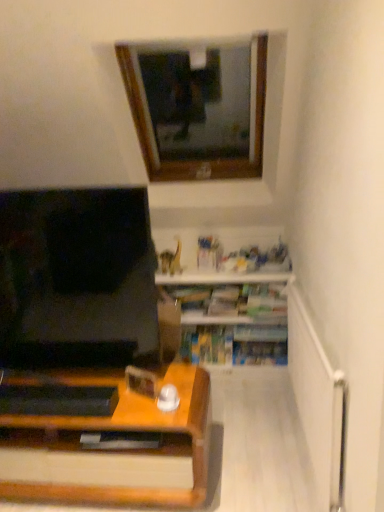
Find the location of a particular element. This screenshot has width=384, height=512. white glossy shelf at lower center is located at coordinates (230, 301).

Measure the distance between point (285, 349) and camera.

Point (285, 349) and camera are 2.75 meters apart.

What do you see at coordinates (230, 301) in the screenshot? This screenshot has width=384, height=512. I see `white glossy shelf at lower center` at bounding box center [230, 301].

In order to face white glossy shelf at lower center, should I rotate leftwards or rightwards?

To face it directly, rotate right by 4.324 degrees.

I want to click on wooden frame at upper center, so click(x=198, y=108).

The height and width of the screenshot is (512, 384). What do you see at coordinates (198, 108) in the screenshot?
I see `wooden frame at upper center` at bounding box center [198, 108].

Where is `white glossy shelf at lower center`? The image size is (384, 512). white glossy shelf at lower center is located at coordinates (230, 301).

Which object is positioned more to the left, white glossy shelf at lower center or wooden frame at upper center?

From the viewer's perspective, wooden frame at upper center appears more on the left side.

Is white glossy shelf at lower center in front of wooden frame at upper center?

No.

Which point is more forward, (245, 326) or (240, 123)?

Positioned in front is point (245, 326).

Consider the image. From the image's perspective, which object appears higher, white glossy shelf at lower center or wooden frame at upper center?

wooden frame at upper center.

From a real-world perspective, is white glossy shelf at lower center physically above wooden frame at upper center?

No.

Is white glossy shelf at lower center thinner than wooden frame at upper center?

Indeed, white glossy shelf at lower center has a lesser width compared to wooden frame at upper center.

Can you confirm if white glossy shelf at lower center is shorter than wooden frame at upper center?

Correct, white glossy shelf at lower center is not as tall as wooden frame at upper center.

In terms of size, does white glossy shelf at lower center appear bigger or smaller than wooden frame at upper center?

Clearly, white glossy shelf at lower center is smaller in size than wooden frame at upper center.

Would you say white glossy shelf at lower center contains wooden frame at upper center?

No, wooden frame at upper center is not a part of white glossy shelf at lower center.

Is white glossy shelf at lower center not near wooden frame at upper center?

Actually, white glossy shelf at lower center and wooden frame at upper center are a little close together.

Is white glossy shelf at lower center facing away from wooden frame at upper center?

No, wooden frame at upper center is not at the back of white glossy shelf at lower center.

How many degrees apart are the facing directions of white glossy shelf at lower center and wooden frame at upper center?

1.97 degrees separate the facing orientations of white glossy shelf at lower center and wooden frame at upper center.

Where is `window in front of the white glossy shelf at lower center`? The width and height of the screenshot is (384, 512). window in front of the white glossy shelf at lower center is located at coordinates (198, 108).

Does wooden frame at upper center appear on the left side of white glossy shelf at lower center?

Indeed, wooden frame at upper center is positioned on the left side of white glossy shelf at lower center.

Is wooden frame at upper center behind white glossy shelf at lower center?

No, wooden frame at upper center is in front of white glossy shelf at lower center.

Is point (221, 56) closer or farther from the camera than point (260, 305)?

Point (221, 56) is farther from the camera than point (260, 305).

From the image's perspective, which is below, wooden frame at upper center or white glossy shelf at lower center?

white glossy shelf at lower center is shown below in the image.

From a real-world perspective, between wooden frame at upper center and white glossy shelf at lower center, who is vertically higher?

From a 3D spatial view, wooden frame at upper center is above.

Looking at their sizes, would you say wooden frame at upper center is wider or thinner than white glossy shelf at lower center?

Considering their sizes, wooden frame at upper center looks broader than white glossy shelf at lower center.

Who is taller, wooden frame at upper center or white glossy shelf at lower center?

wooden frame at upper center.

Considering the relative sizes of wooden frame at upper center and white glossy shelf at lower center in the image provided, is wooden frame at upper center smaller than white glossy shelf at lower center?

No, wooden frame at upper center is not smaller than white glossy shelf at lower center.

Is wooden frame at upper center not inside white glossy shelf at lower center?

Yes, wooden frame at upper center is not within white glossy shelf at lower center.

Is wooden frame at upper center in contact with white glossy shelf at lower center?

wooden frame at upper center is not next to white glossy shelf at lower center, and they're not touching.

In the scene shown: Is wooden frame at upper center looking in the opposite direction of white glossy shelf at lower center?

No, wooden frame at upper center's orientation is not away from white glossy shelf at lower center.

How many degrees apart are the facing directions of wooden frame at upper center and white glossy shelf at lower center?

The facing directions of wooden frame at upper center and white glossy shelf at lower center are 1.97 degrees apart.

In the image, there is a wooden frame at upper center. Where is `shelf below it (from the image's perspective)`? shelf below it (from the image's perspective) is located at coordinates (230, 301).

Identify the location of window above the white glossy shelf at lower center (from a real-world perspective). This screenshot has width=384, height=512. (198, 108).

Locate an element on the screen. The image size is (384, 512). window above the white glossy shelf at lower center (from the image's perspective) is located at coordinates (198, 108).